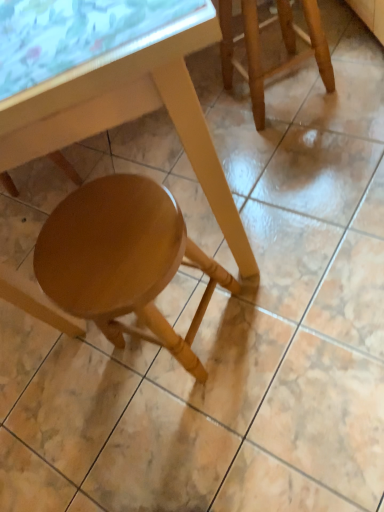
Question: Which direction should I rotate to look at glossy wood stool at lower center, marked as the first stool in a bottom-to-top arrangement?

Choices:
 (A) right
 (B) left

Answer: (B)

Question: Is glossy wood stool at lower center, which is the 1th stool in left-to-right order, further to camera compared to transparent glass table at upper left?

Choices:
 (A) no
 (B) yes

Answer: (B)

Question: Does glossy wood stool at lower center, marked as the first stool in a bottom-to-top arrangement, have a lesser height compared to transparent glass table at upper left?

Choices:
 (A) yes
 (B) no

Answer: (B)

Question: From a real-world perspective, is glossy wood stool at lower center, marked as the first stool in a bottom-to-top arrangement, positioned under transparent glass table at upper left based on gravity?

Choices:
 (A) no
 (B) yes

Answer: (B)

Question: Can you confirm if glossy wood stool at lower center, which is the 1th stool in left-to-right order, is bigger than transparent glass table at upper left?

Choices:
 (A) no
 (B) yes

Answer: (B)

Question: Are glossy wood stool at lower center, which is counted as the 2th stool, starting from the right, and transparent glass table at upper left located far from each other?

Choices:
 (A) no
 (B) yes

Answer: (A)

Question: Can transparent glass table at upper left be found inside glossy wood stool at lower center, which is counted as the 2th stool, starting from the right?

Choices:
 (A) yes
 (B) no

Answer: (B)

Question: Is the depth of wooden stool at upper right, arranged as the 2th stool when viewed from the left, less than that of matte wood table at lower center?

Choices:
 (A) no
 (B) yes

Answer: (A)

Question: Can you confirm if wooden stool at upper right, the 1th stool viewed from the right, is bigger than matte wood table at lower center?

Choices:
 (A) no
 (B) yes

Answer: (A)

Question: Does wooden stool at upper right, which is the second stool in bottom-to-top order, have a lesser width compared to matte wood table at lower center?

Choices:
 (A) yes
 (B) no

Answer: (A)

Question: From the image's perspective, is wooden stool at upper right, which is the second stool in bottom-to-top order, over matte wood table at lower center?

Choices:
 (A) no
 (B) yes

Answer: (B)

Question: Considering the relative sizes of wooden stool at upper right, the 1th stool positioned from the top, and matte wood table at lower center in the image provided, is wooden stool at upper right, the 1th stool positioned from the top, wider than matte wood table at lower center?

Choices:
 (A) no
 (B) yes

Answer: (A)

Question: Is wooden stool at upper right, which is the second stool in bottom-to-top order, positioned beyond the bounds of matte wood table at lower center?

Choices:
 (A) no
 (B) yes

Answer: (B)

Question: From a real-world perspective, does matte wood table at lower center stand above glossy wood stool at lower center, which is the second stool in top-to-bottom order?

Choices:
 (A) no
 (B) yes

Answer: (B)